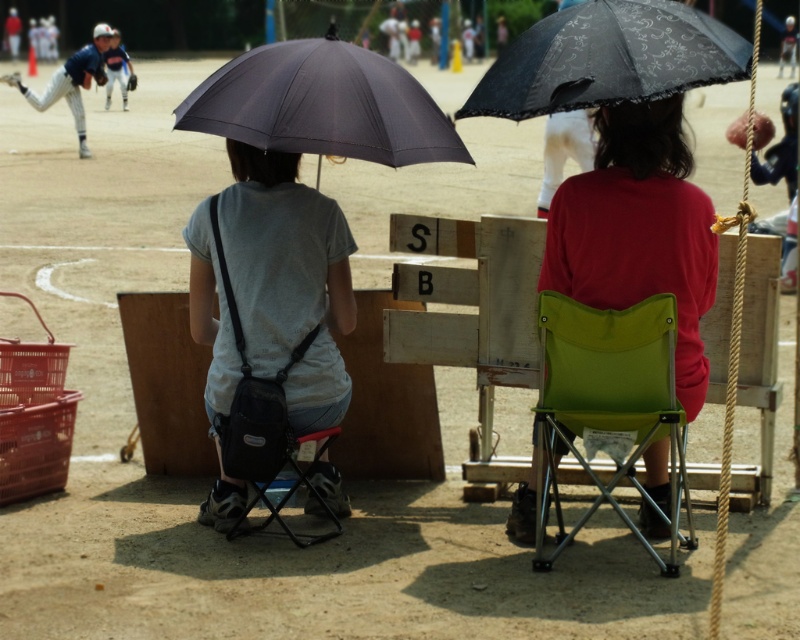
You are a spectator at the baseball game and want to throw a baseball from the matte blue baseball glove at upper left to the matte red shirt at center. Can you reach the target with a single throw?

The distance between the matte blue baseball glove at upper left and the matte red shirt at center is 35.43 meters. A typical throw by a spectator may not cover that distance, so it might be difficult to reach the target with a single throw.

You are attending a baseball game and need to decide where to sit. You see the green fabric folding chair at center and the matte blue baseball uniform at upper left. Which object is shorter in height?

The green fabric folding chair at center is shorter than the matte blue baseball uniform at upper left.

You are a photographer standing at the camera position. You want to take a photo that includes both the point at [638,420] and the point at [88,74]. Which point will appear larger in the photo?

Point at [638,420] will appear larger in the photo because it is closer to the camera than the point at [88,74].